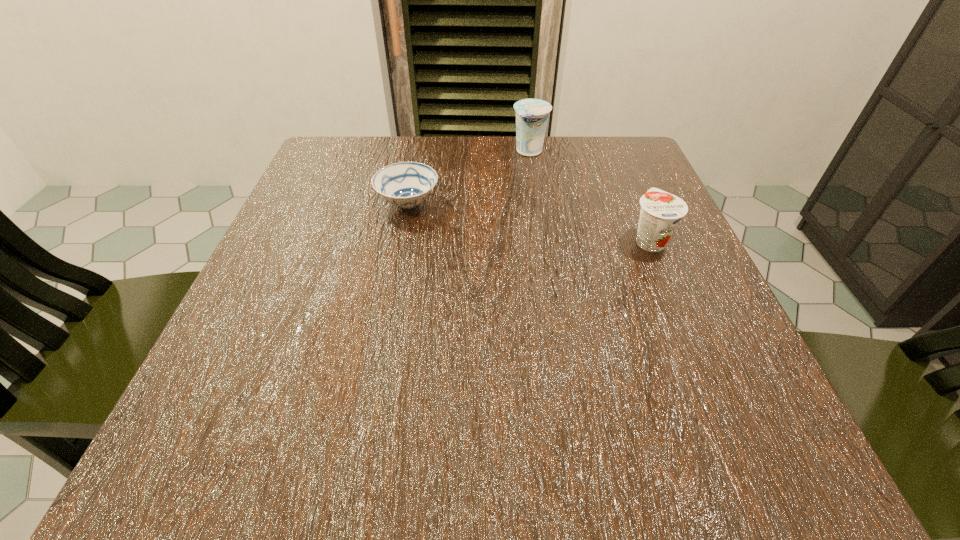
Find the location of `soup bowl present at the far edge`. soup bowl present at the far edge is located at coordinates (406, 184).

The height and width of the screenshot is (540, 960). I want to click on object situated at the right edge, so click(660, 213).

You are a GUI agent. You are given a task and a screenshot of the screen. Output one action in this format:
    pyautogui.click(x=<x>, y=<y>)
    Task: Click on the vacant space at the far edge of the desktop
    The image size is (960, 540).
    Given the screenshot: What is the action you would take?
    pyautogui.click(x=498, y=173)

Where is `free space at the near edge of the desktop`? free space at the near edge of the desktop is located at coordinates (463, 474).

I want to click on vacant region at the left edge of the desktop, so [x=246, y=338].

In the image, there is a desktop. Find the location of `free space at the right edge`. free space at the right edge is located at coordinates pyautogui.click(x=720, y=335).

Find the location of a particular element. The image size is (960, 540). vacant space at the far left corner is located at coordinates (312, 180).

Where is `vacant space at the near left corner of the desktop`? Image resolution: width=960 pixels, height=540 pixels. vacant space at the near left corner of the desktop is located at coordinates 189,415.

The width and height of the screenshot is (960, 540). Identify the location of vacant space at the far right corner. (585, 188).

Locate an element on the screen. free space between the leftmost object and the taller yogurt is located at coordinates (468, 177).